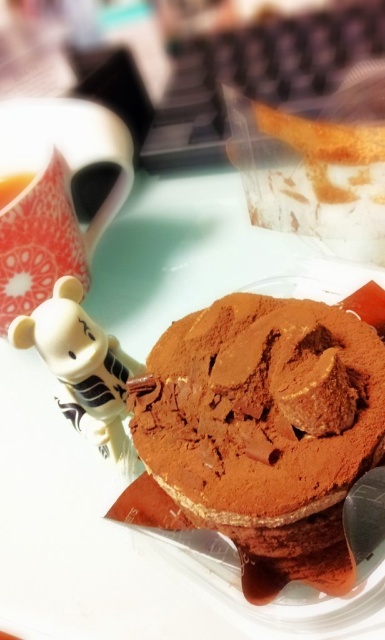
Can you confirm if chocolatesmoothcake at center is thinner than matte white teacup at upper left?

No, chocolatesmoothcake at center is not thinner than matte white teacup at upper left.

Is chocolatesmoothcake at center closer to the viewer compared to matte white teacup at upper left?

Yes, it is in front of matte white teacup at upper left.

Which is in front, point (279, 516) or point (23, 176)?

Point (279, 516) is in front.

Where is `chocolatesmoothcake at center`? The image size is (385, 640). chocolatesmoothcake at center is located at coordinates (266, 429).

Image resolution: width=385 pixels, height=640 pixels. I want to click on chocolatesmoothcake at center, so click(x=266, y=429).

Is chocolatesmoothcake at center smaller than white matte bear at left?

No, chocolatesmoothcake at center is not smaller than white matte bear at left.

In order to click on chocolatesmoothcake at center in this screenshot , I will do `click(266, 429)`.

The width and height of the screenshot is (385, 640). Identify the location of chocolatesmoothcake at center. (266, 429).

From the picture: Between white matte bear at left and matte white teacup at upper left, which one is positioned lower?

Positioned lower is white matte bear at left.

Between white matte bear at left and matte white teacup at upper left, which one has more height?

white matte bear at left

Which is behind, point (120, 378) or point (11, 182)?

The point (11, 182) is behind.

The image size is (385, 640). I want to click on white matte bear at left, so click(x=80, y=364).